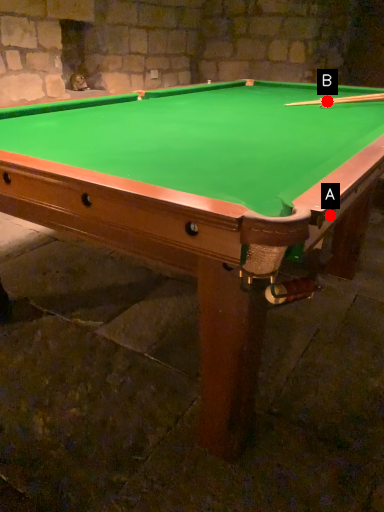
Question: Two points are circled on the image, labeled by A and B beside each circle. Which point is further to the camera?

Choices:
 (A) A is further
 (B) B is further

Answer: (B)